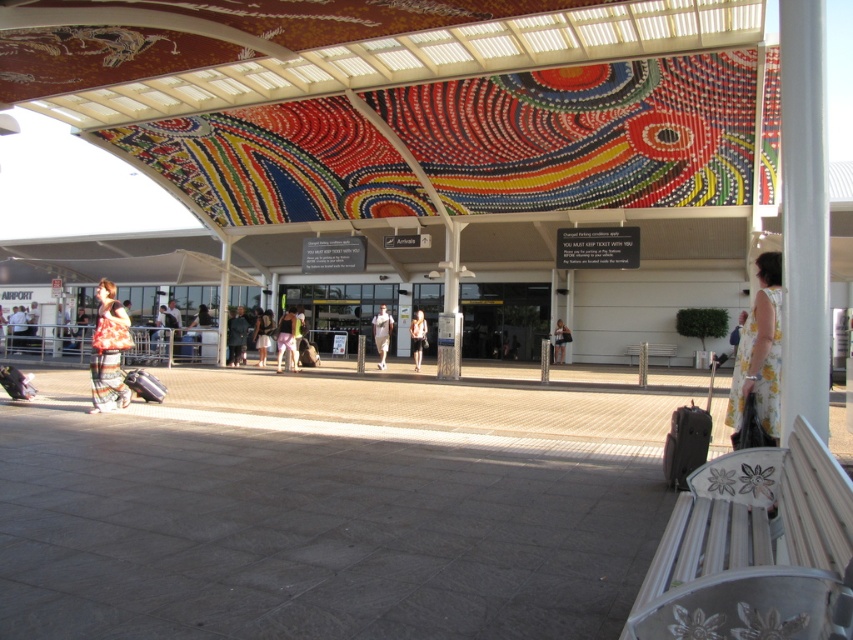
You are an airport security officer observing two travelers wearing different dresses. The floral fabric dress at lower left and the light brown fabric dress at center. Which traveler is positioned closer to the right side of the scene?

The light brown fabric dress at center is positioned closer to the right side of the scene compared to the floral fabric dress at lower left.

You are a traveler at the airport terminal. You see a light brown fabric dress at center and a matte black suitcase at lower left. Which item is located higher in the image?

The light brown fabric dress at center is positioned over the matte black suitcase at lower left, so it is higher in the image.